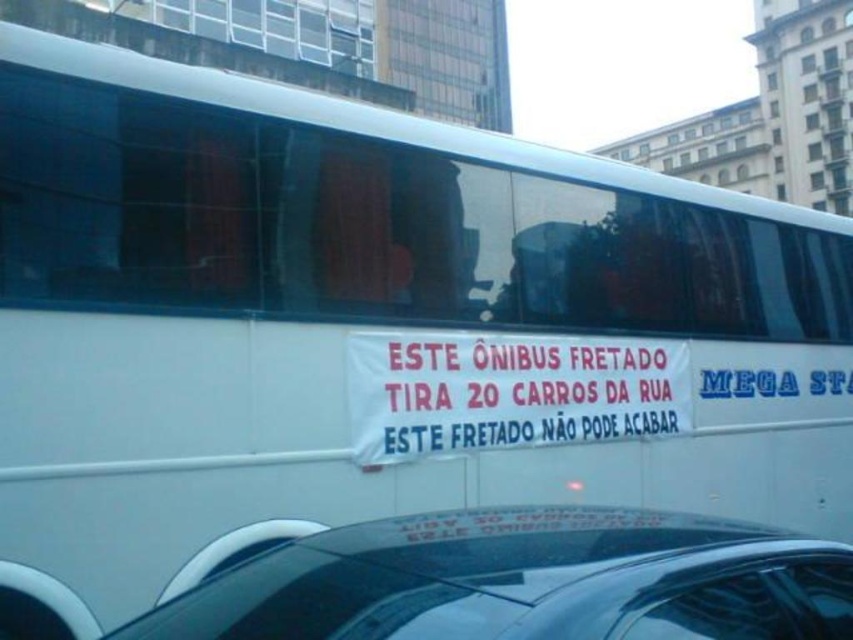
Question: Is black glossy car at lower center positioned at the back of white paper banner at center?

Choices:
 (A) no
 (B) yes

Answer: (A)

Question: Can you confirm if black glossy car at lower center is wider than white paper banner at center?

Choices:
 (A) no
 (B) yes

Answer: (A)

Question: Which of the following is the farthest from the observer?

Choices:
 (A) white paper banner at center
 (B) black glossy car at lower center

Answer: (A)

Question: Is black glossy car at lower center thinner than white paper banner at center?

Choices:
 (A) yes
 (B) no

Answer: (A)

Question: Which object is farther from the camera taking this photo?

Choices:
 (A) white paper banner at center
 (B) black glossy car at lower center

Answer: (A)